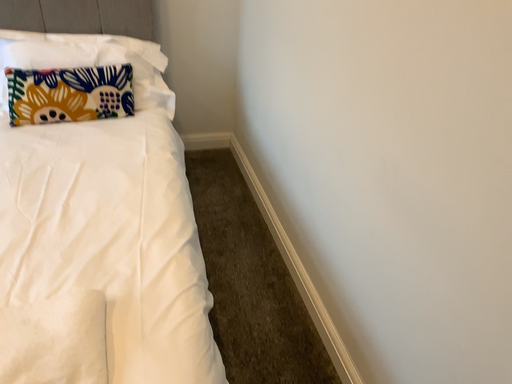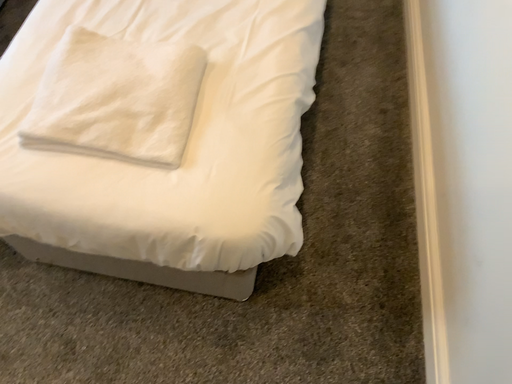
Question: How did the camera likely rotate when shooting the video?

Choices:
 (A) rotated downward
 (B) rotated upward

Answer: (A)